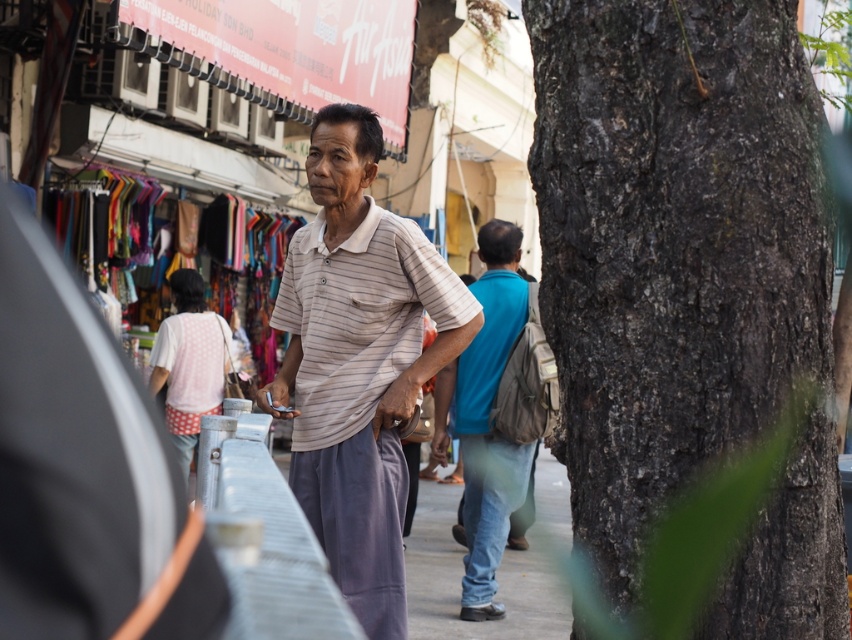
Question: Does striped cotton shirt at center appear on the right side of blue denim jeans at center?

Choices:
 (A) yes
 (B) no

Answer: (B)

Question: Which point is closer to the camera taking this photo?

Choices:
 (A) (430, 595)
 (B) (692, 88)

Answer: (B)

Question: Among these objects, which one is farthest from the camera?

Choices:
 (A) gray concrete pavement at center
 (B) dark brown bark at right

Answer: (A)

Question: Which of the following is the farthest from the observer?

Choices:
 (A) dark brown bark at right
 (B) gray concrete pavement at center

Answer: (B)

Question: Does dark brown bark at right appear on the left side of striped cotton shirt at center?

Choices:
 (A) no
 (B) yes

Answer: (A)

Question: Is striped cotton shirt at center above gray concrete pavement at center?

Choices:
 (A) no
 (B) yes

Answer: (B)